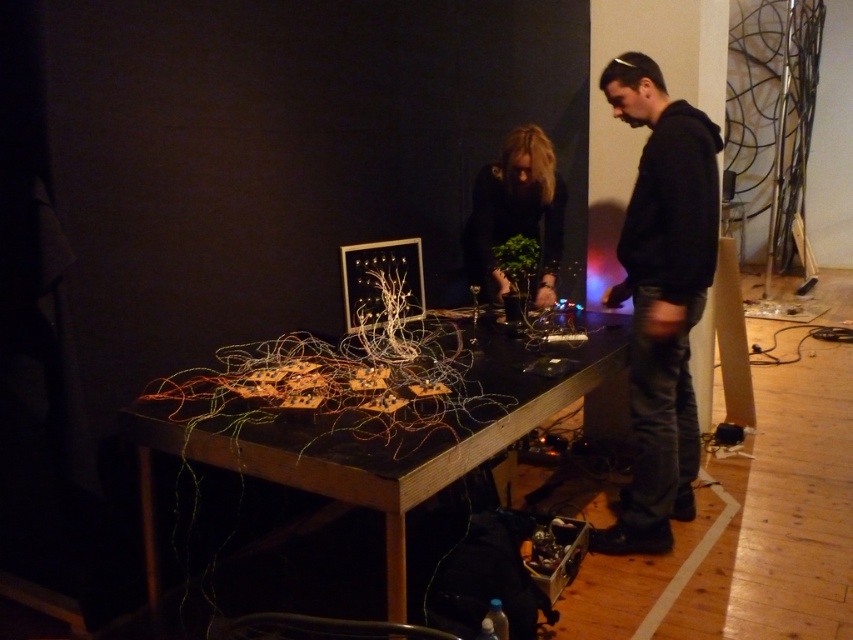
You are standing in the room and want to pick up an item from the wooden table at center. To reach it, you must pass the black hoodie at right. Which object should you approach first?

You should approach the wooden table at center first because it is closer to you than the black hoodie at right, so you can reach it without needing to move the hoodie first.

You are a delivery person who needs to place a small package between the black hoodie at right and the black matte plant at center. Can you fit it there?

The black hoodie at right might be wider than black matte plant at center, so there might not be enough space between them to fit the small package.